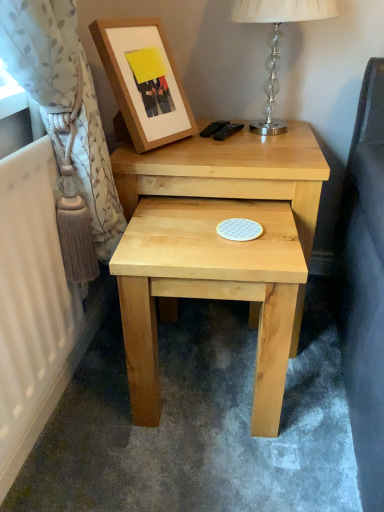
Question: Is natural wood nightstand at center taller or shorter than light beige floral fabric curtain at left?

Choices:
 (A) short
 (B) tall

Answer: (B)

Question: From a real-world perspective, relative to light beige floral fabric curtain at left, is natural wood nightstand at center vertically above or below?

Choices:
 (A) below
 (B) above

Answer: (A)

Question: Which object is the farthest from the light beige floral fabric curtain at left?

Choices:
 (A) natural wood nightstand at center
 (B) wooden picture frame at upper left
 (C) clear glass lamp at upper right
 (D) natural wood stool at center

Answer: (C)

Question: Estimate the real-world distances between objects in this image. Which object is farther from the clear glass lamp at upper right?

Choices:
 (A) light beige floral fabric curtain at left
 (B) natural wood stool at center
 (C) wooden picture frame at upper left
 (D) natural wood nightstand at center

Answer: (B)